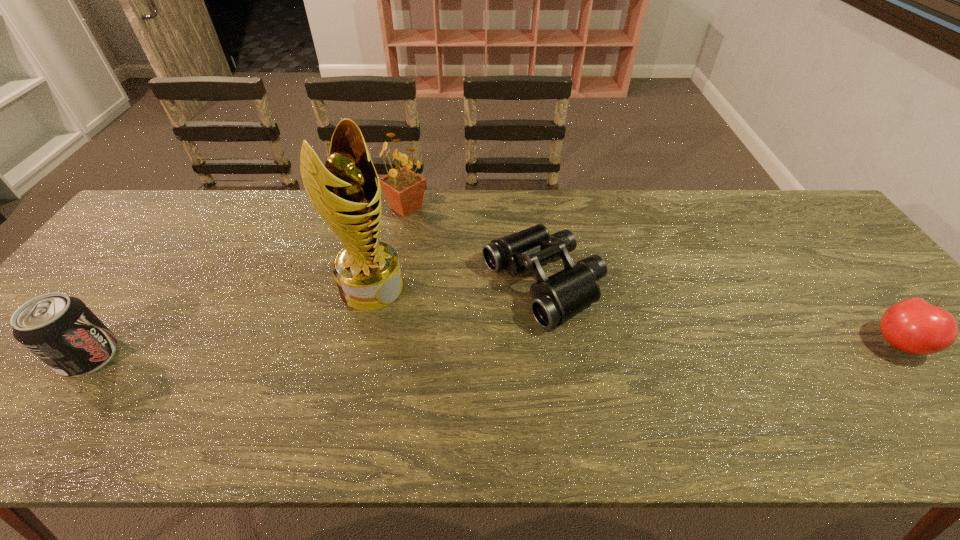
Locate an element on the screen. The height and width of the screenshot is (540, 960). the third shortest object is located at coordinates (60, 330).

Locate an element on the screen. This screenshot has height=540, width=960. soda can is located at coordinates (60, 330).

At what (x,y) coordinates should I click in order to perform the action: click on the rightmost object. Please return your answer as a coordinate pair (x, y). Looking at the image, I should click on coord(913,326).

Locate an element on the screen. This screenshot has width=960, height=540. the tallest object is located at coordinates (345, 193).

What are the coordinates of `binoculars` in the screenshot? It's located at (557, 298).

At what (x,y) coordinates should I click in order to perform the action: click on the farthest object. Please return your answer as a coordinate pair (x, y). The image size is (960, 540). Looking at the image, I should click on pyautogui.click(x=404, y=189).

Image resolution: width=960 pixels, height=540 pixels. I want to click on sunflower, so click(404, 189).

Where is `vacant space situated on the back of the third tallest object`? vacant space situated on the back of the third tallest object is located at coordinates point(157,263).

You are a GUI agent. You are given a task and a screenshot of the screen. Output one action in this format:
    pyautogui.click(x=<x>, y=<y>)
    Task: Click on the free space located on the front-facing side of the award
    
    Given the screenshot: What is the action you would take?
    (488, 360)

Locate an element on the screen. The width and height of the screenshot is (960, 540). vacant space positioned 0.350m on the front-facing side of the award is located at coordinates (506, 371).